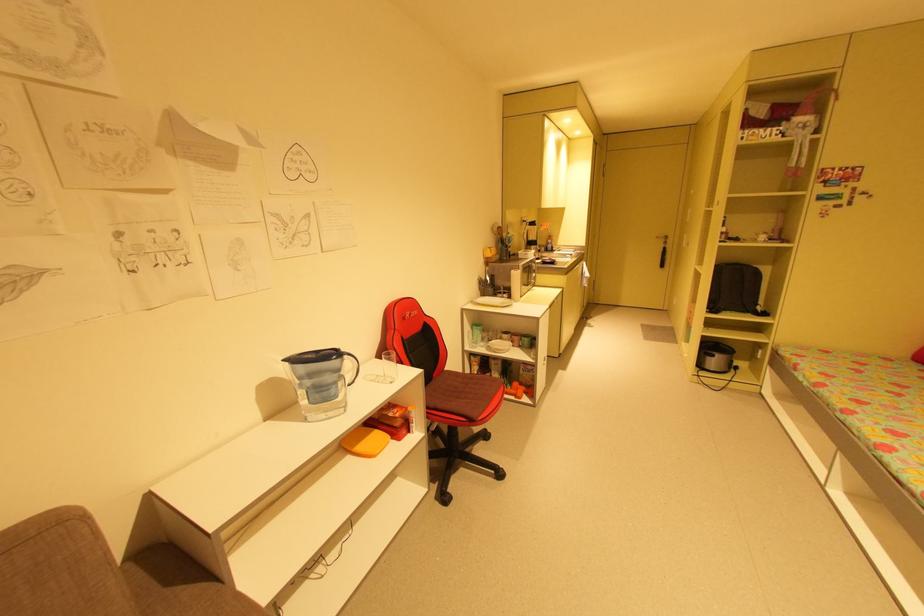
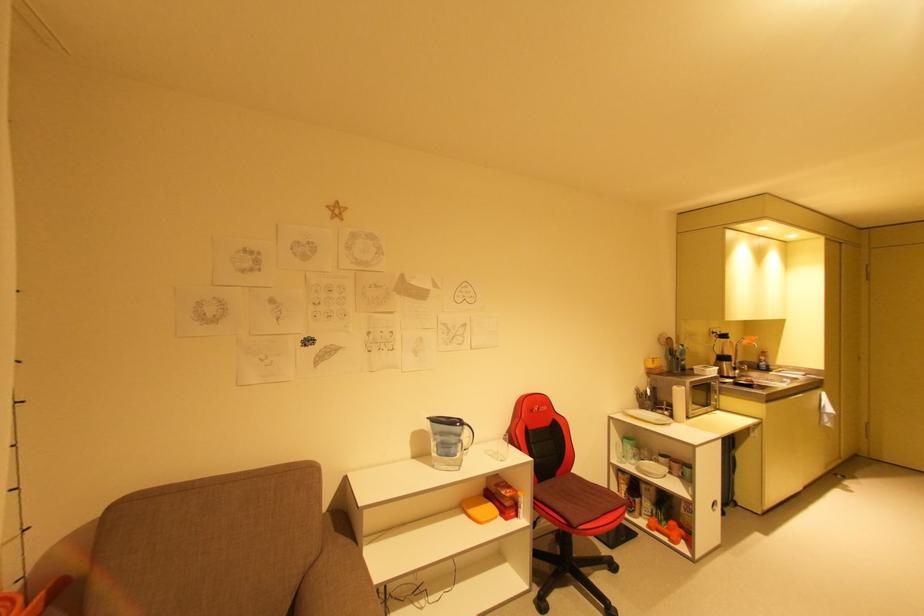
The point at (x=435, y=406) is marked in the first image. Where is the corresponding point in the second image?

(544, 498)